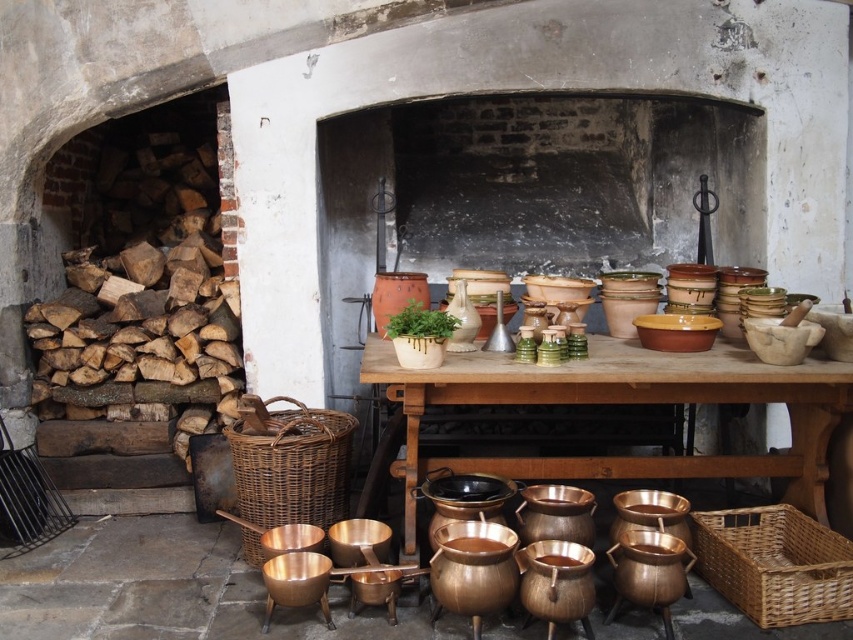
Looking at this image, you are standing in the rustic kitchen scene and want to place a new decorative item on the matte ceramic table at center. However, you need to ensure it won not block the view of the woven brown basket at lower right. Can you do this?

The matte ceramic table at center is in front of the woven brown basket at lower right. Since the table is positioned in front, placing an item on it would block the view of the basket unless the item is small enough to not obstruct the line of sight. However, without knowing the size of the decorative item, it is uncertain. But according to the given information, the table is in front, so any item placed on it would likely block the basket from view.

From the picture: You are a chef preparing to place a 70 cm long platter on the matte ceramic table at center. There is a woven brown basket at lower center nearby. Can the platter fit on the table without touching the basket?

The distance between the matte ceramic table at center and the woven brown basket at lower center is 72.45 centimeters. Since the platter is 70 cm long, it can fit on the table without touching the basket as there is enough space between them.

You are setting up a rustic kitchen scene and need to place the matte ceramic table at center and the woven brown basket at lower center. Based on their sizes, which object would require more horizontal space on the table?

The matte ceramic table at center is wider than the woven brown basket at lower center, so it would require more horizontal space on the table.